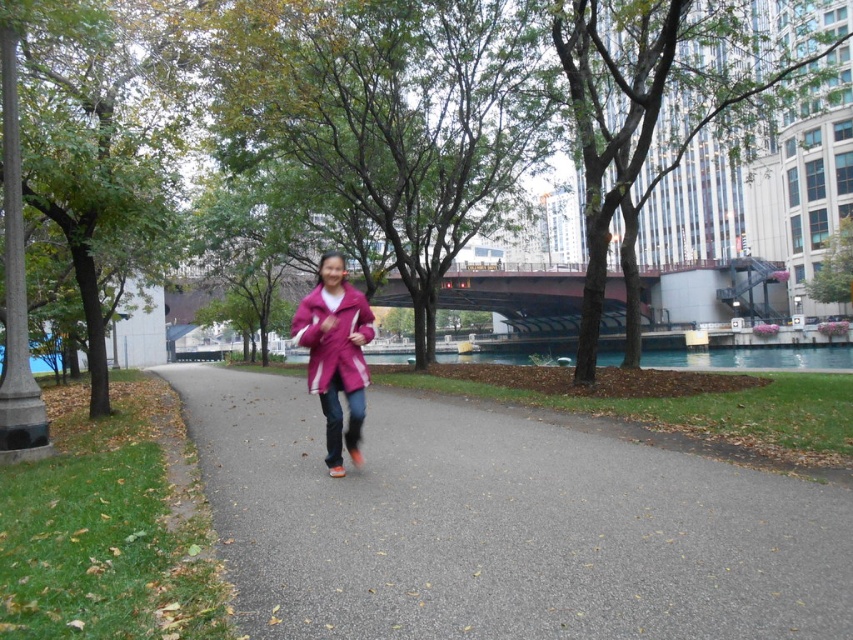
Question: Does smooth asphalt path at center appear on the right side of pink matte jacket at center?

Choices:
 (A) no
 (B) yes

Answer: (B)

Question: Which is nearer to the matte pink jacket at center?

Choices:
 (A) smooth asphalt path at center
 (B) pink matte jacket at center

Answer: (B)

Question: Is pink matte jacket at center above matte pink jacket at center?

Choices:
 (A) yes
 (B) no

Answer: (B)

Question: Estimate the real-world distances between objects in this image. Which object is farther from the pink matte jacket at center?

Choices:
 (A) matte pink jacket at center
 (B) smooth asphalt path at center

Answer: (B)

Question: Estimate the real-world distances between objects in this image. Which object is closer to the matte pink jacket at center?

Choices:
 (A) pink matte jacket at center
 (B) smooth asphalt path at center

Answer: (A)

Question: Is smooth asphalt path at center positioned at the back of pink matte jacket at center?

Choices:
 (A) no
 (B) yes

Answer: (A)